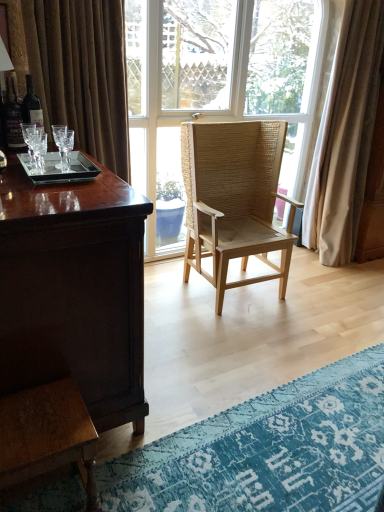
Question: Does beige fabric curtain at right have a lesser height compared to natural woven wood chair at center?

Choices:
 (A) no
 (B) yes

Answer: (A)

Question: Is natural woven wood chair at center at the back of beige fabric curtain at right?

Choices:
 (A) yes
 (B) no

Answer: (B)

Question: Is beige fabric curtain at right closer to the viewer compared to natural woven wood chair at center?

Choices:
 (A) yes
 (B) no

Answer: (B)

Question: Considering the relative sizes of beige fabric curtain at right and natural woven wood chair at center in the image provided, is beige fabric curtain at right thinner than natural woven wood chair at center?

Choices:
 (A) yes
 (B) no

Answer: (A)

Question: Is beige fabric curtain at right located outside natural woven wood chair at center?

Choices:
 (A) no
 (B) yes

Answer: (B)

Question: Is beige fabric curtain at right at the left side of natural woven wood chair at center?

Choices:
 (A) no
 (B) yes

Answer: (A)

Question: Can you confirm if blue textured rug at lower right is wider than clear glass tray at left?

Choices:
 (A) no
 (B) yes

Answer: (B)

Question: Does blue textured rug at lower right appear on the left side of clear glass tray at left?

Choices:
 (A) yes
 (B) no

Answer: (B)

Question: Is blue textured rug at lower right oriented away from clear glass tray at left?

Choices:
 (A) yes
 (B) no

Answer: (B)

Question: Is blue textured rug at lower right behind clear glass tray at left?

Choices:
 (A) yes
 (B) no

Answer: (B)

Question: From a real-world perspective, is blue textured rug at lower right on clear glass tray at left?

Choices:
 (A) no
 (B) yes

Answer: (A)

Question: From the image's perspective, is blue textured rug at lower right beneath clear glass tray at left?

Choices:
 (A) no
 (B) yes

Answer: (B)

Question: Can you confirm if shiny brown wood desk at left is positioned to the left of natural woven wood chair at center?

Choices:
 (A) yes
 (B) no

Answer: (A)